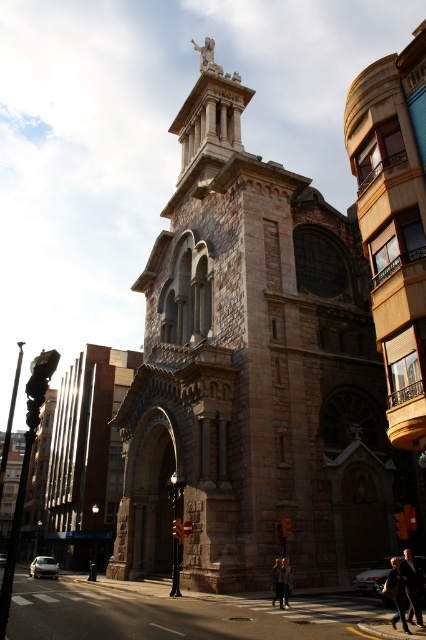
You are a tourist standing in front of the historic stone church and notice two objects at the center of the scene. Which object is bigger between the brown stone tower at center and the dark gray coat at center?

The brown stone tower at center is larger in size than the dark gray coat at center.

You are standing in front of the historic stone church and see the brown stone tower at center and the dark gray coat at center. Which object is positioned higher in the scene?

The brown stone tower at center is located above the dark gray coat at center, so it is positioned higher in the scene.

In the scene shown: You are a photographer trying to capture a portrait of the blonde hair person at center without including the dark brown leather jacket at center in the frame. Given that your camera has a fixed focal length, would adjusting the camera angle allow you to exclude the jacket?

The dark brown leather jacket at center is wider than the blonde hair person at center, so adjusting the camera angle might not be sufficient to exclude the jacket entirely. The jacket occupies more space horizontally, making it challenging to frame the person without including part of the jacket.